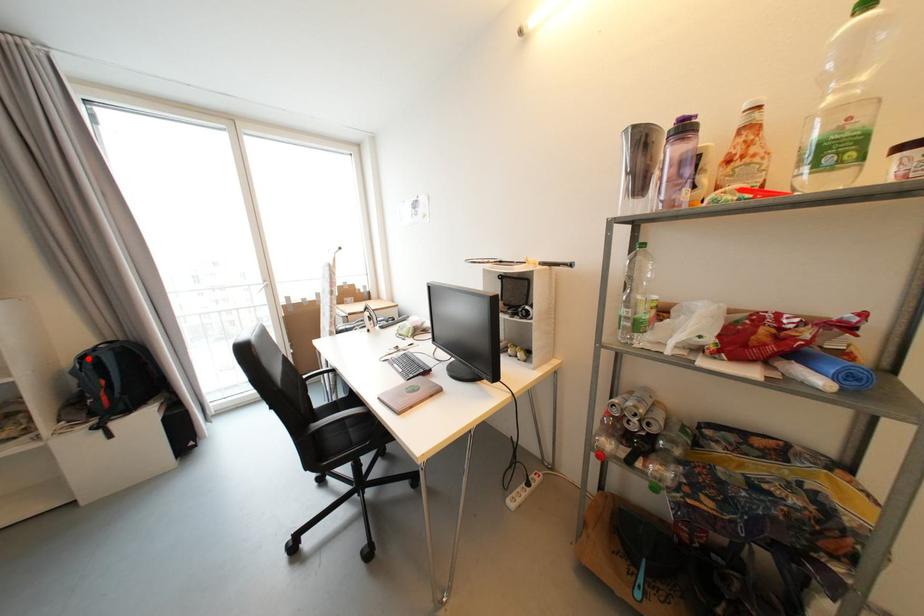
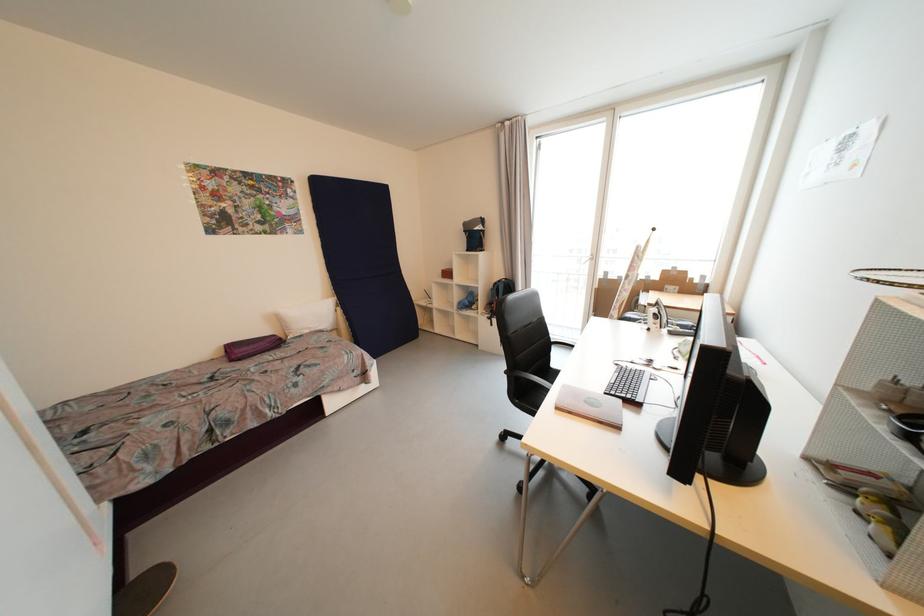
In the second image, find the point that corresponds to the highlighted location in the first image.

(501, 285)